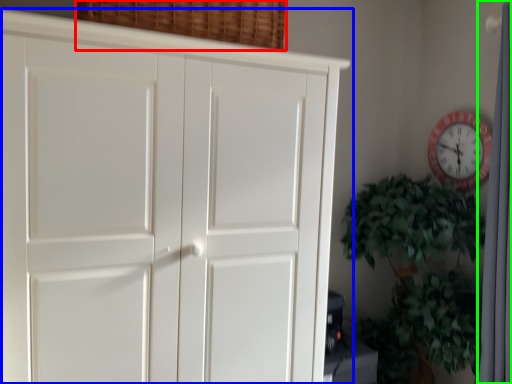
Question: Estimate the real-world distances between objects in this image. Which object is farther from basket (highlighted by a red box), cupboard (highlighted by a blue box) or curtain (highlighted by a green box)?

Choices:
 (A) cupboard
 (B) curtain

Answer: (B)